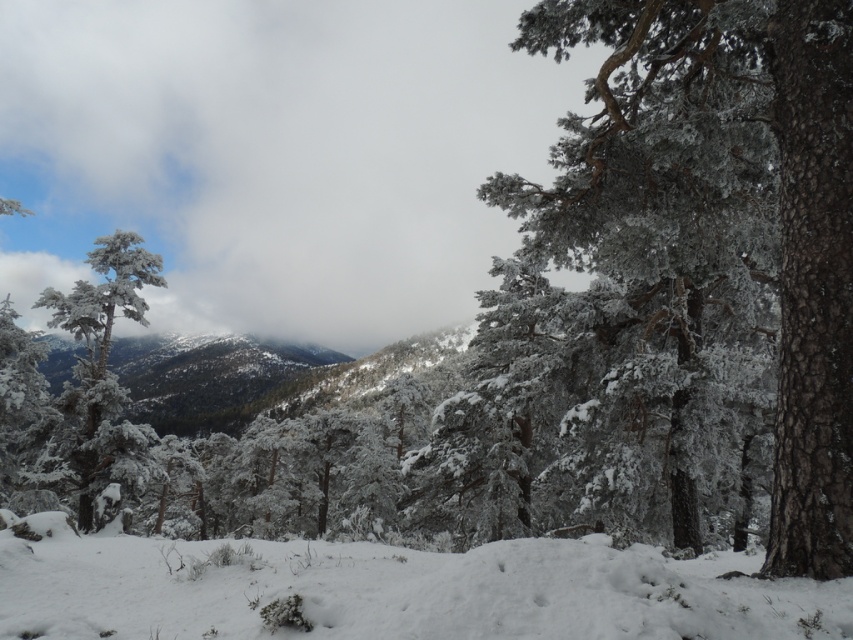
You are an airplane pilot flying over the winter landscape. You notice the white fluffy cloud at upper center. Can you determine its exact location in the image using coordinates?

The white fluffy cloud at upper center is located at coordinates point [273,156].

You are an observer standing in the winter landscape. You notice the white frosty tree at left and the snowy evergreen forest at left. Which one appears nearer to you?

The white frosty tree at left appears nearer to you because it is closer to the viewer than the snowy evergreen forest at left.

You are an outdoor photographer planning to capture the white fluffy snow at lower center and the snowy evergreen forest at left in a single shot. Given that your camera has a maximum focus range of 700 feet, will you be able to capture both subjects clearly in your photograph?

The distance between the white fluffy snow at lower center and the snowy evergreen forest at left is 696.08 feet, which is within the camera maximum focus range of 700 feet. So yes, you can capture both subjects clearly in a single shot.